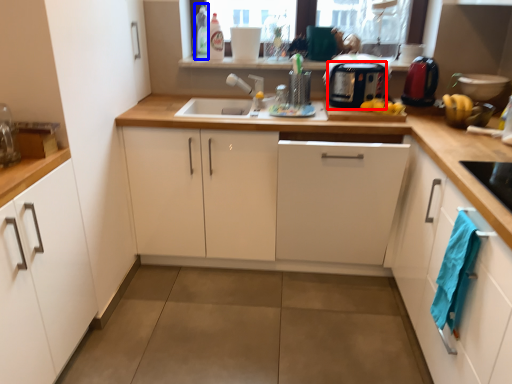
Question: Which object is closer to the camera taking this photo, appliance (highlighted by a red box) or bottle (highlighted by a blue box)?

Choices:
 (A) appliance
 (B) bottle

Answer: (A)